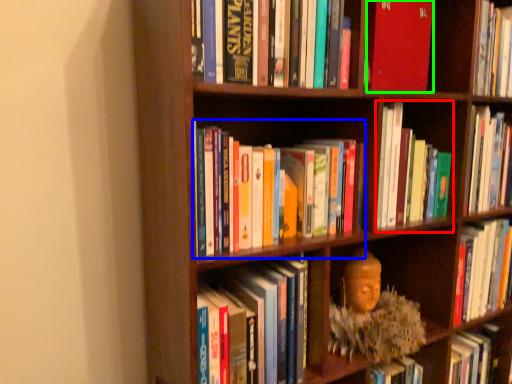
Question: Considering the real-world distances, which object is closest to book (highlighted by a red box)? book (highlighted by a blue box) or book (highlighted by a green box).

Choices:
 (A) book
 (B) book

Answer: (B)